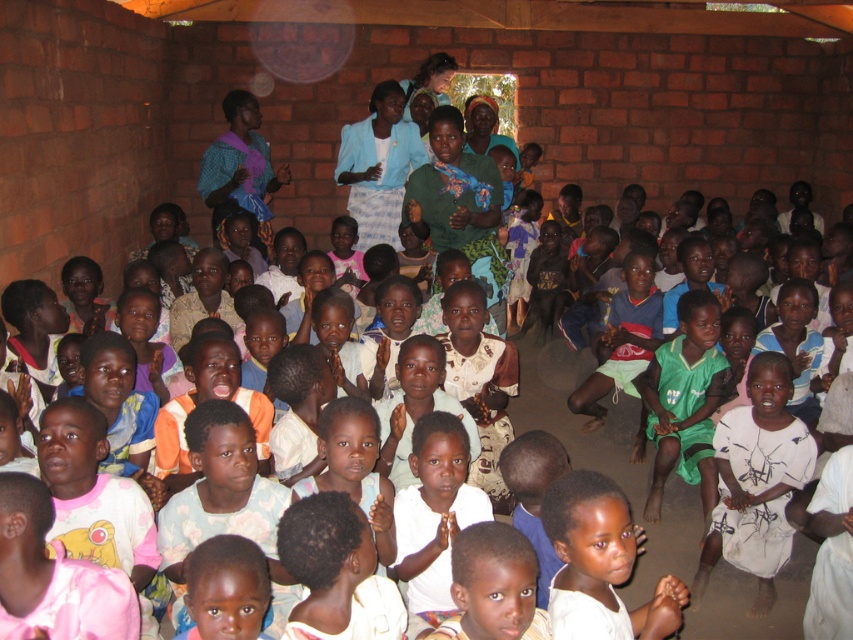
Question: Observing the image, what is the correct spatial positioning of white printed dress at lower right in reference to white matte shirt at lower center?

Choices:
 (A) below
 (B) above

Answer: (A)

Question: Is white printed dress at lower right bigger than white matte shirt at lower center?

Choices:
 (A) no
 (B) yes

Answer: (B)

Question: Which object appears closest to the camera in this image?

Choices:
 (A) white printed dress at lower right
 (B) white matte shirt at lower center

Answer: (B)

Question: Is the position of white printed dress at lower right more distant than that of white matte shirt at lower center?

Choices:
 (A) no
 (B) yes

Answer: (B)